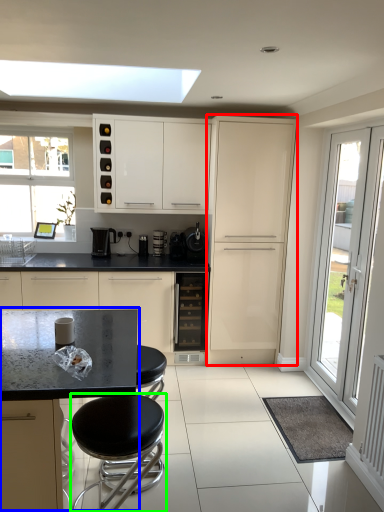
Question: Estimate the real-world distances between objects in this image. Which object is closer to cabinetry (highlighted by a red box), round table (highlighted by a blue box) or stool (highlighted by a green box)?

Choices:
 (A) round table
 (B) stool

Answer: (A)